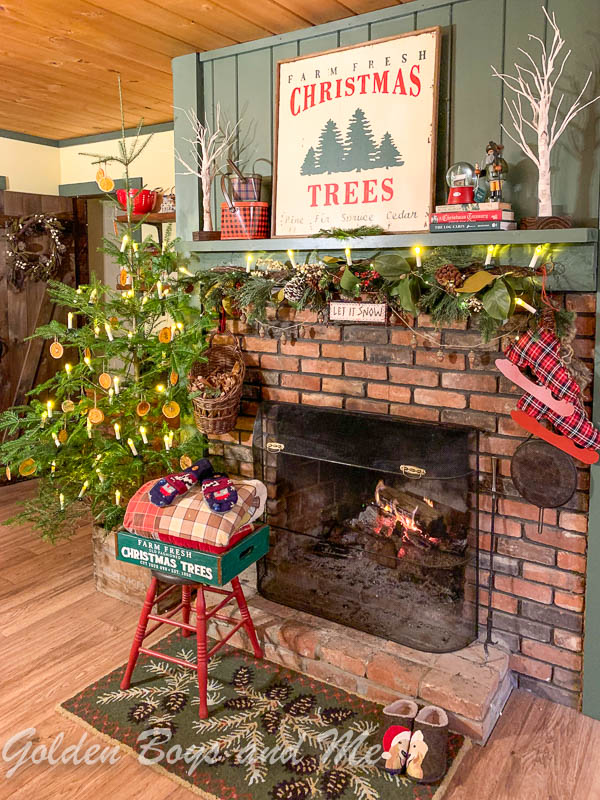
Find the let it snow sign in the image. Your answer should be formatted as a list of tuples, i.e. [(x1, y1), (x2, y2), ...], where each tuple contains the x and y coordinates of a point satisfying the conditions above.

[(340, 309), (350, 308), (366, 312)]